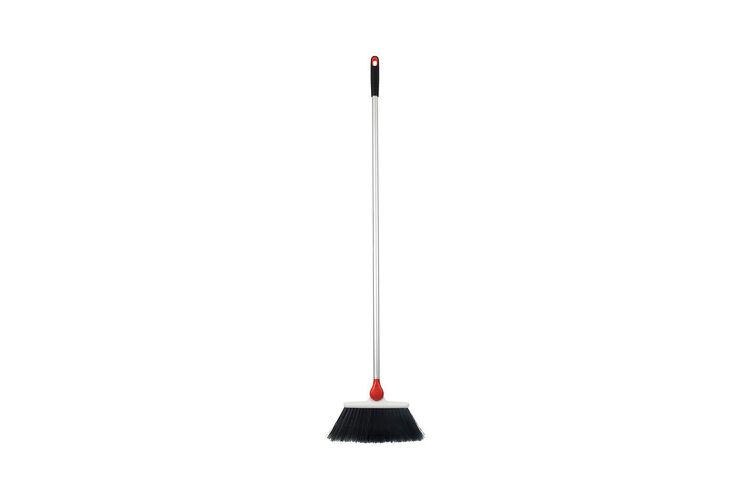
Where is `metal bar for broom`? The image size is (750, 500). metal bar for broom is located at coordinates (373, 107), (370, 141), (374, 226), (375, 294), (374, 354).